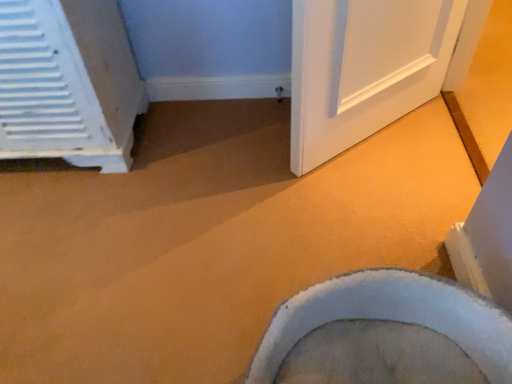
Question: Is white soft toilet at lower right at the right side of white plastic radiator at left?

Choices:
 (A) yes
 (B) no

Answer: (A)

Question: Is white soft toilet at lower right located outside white plastic radiator at left?

Choices:
 (A) yes
 (B) no

Answer: (A)

Question: Considering the relative sizes of white soft toilet at lower right and white plastic radiator at left in the image provided, is white soft toilet at lower right smaller than white plastic radiator at left?

Choices:
 (A) yes
 (B) no

Answer: (A)

Question: From a real-world perspective, is white soft toilet at lower right beneath white plastic radiator at left?

Choices:
 (A) no
 (B) yes

Answer: (B)

Question: From a real-world perspective, is white soft toilet at lower right located higher than white plastic radiator at left?

Choices:
 (A) no
 (B) yes

Answer: (A)

Question: Does white soft toilet at lower right come in front of white plastic radiator at left?

Choices:
 (A) no
 (B) yes

Answer: (B)

Question: Is white plastic radiator at left positioned before white soft toilet at lower right?

Choices:
 (A) no
 (B) yes

Answer: (A)

Question: Does white plastic radiator at left touch white soft toilet at lower right?

Choices:
 (A) no
 (B) yes

Answer: (A)

Question: Can we say white plastic radiator at left lies outside white soft toilet at lower right?

Choices:
 (A) yes
 (B) no

Answer: (A)

Question: Can you confirm if white plastic radiator at left is positioned to the left of white soft toilet at lower right?

Choices:
 (A) no
 (B) yes

Answer: (B)

Question: From the image's perspective, is white plastic radiator at left located above white soft toilet at lower right?

Choices:
 (A) yes
 (B) no

Answer: (A)

Question: Considering the relative sizes of white plastic radiator at left and white soft toilet at lower right in the image provided, is white plastic radiator at left bigger than white soft toilet at lower right?

Choices:
 (A) yes
 (B) no

Answer: (A)

Question: From a real-world perspective, is white soft toilet at lower right positioned above or below white plastic radiator at left?

Choices:
 (A) below
 (B) above

Answer: (A)